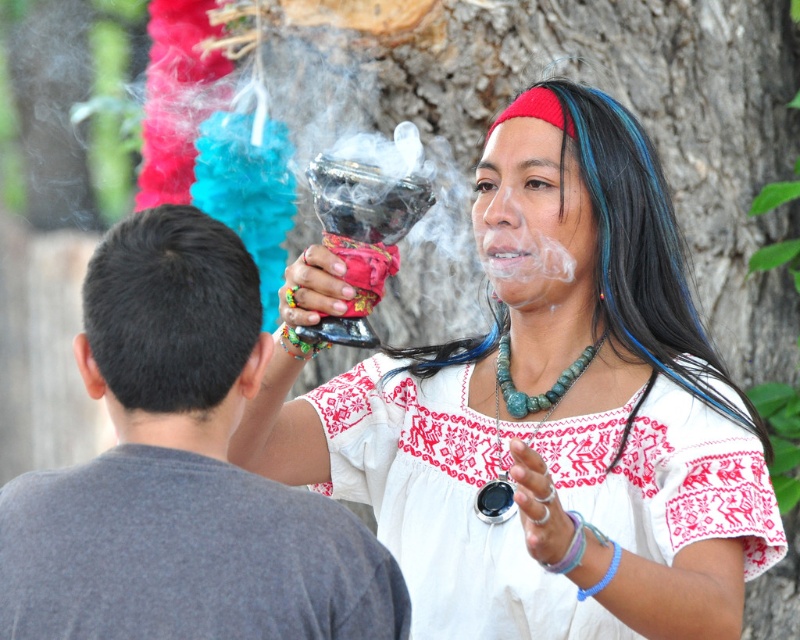
Consider the image. You are an event planner organizing a cultural exhibition and need to display two traditional garments. The gray cotton shirt at upper left and the white embroidered dress at center must be placed side by side. Which garment has a smaller width and should be positioned to the left to maintain visual balance?

The gray cotton shirt at upper left has a smaller width than the white embroidered dress at center, so it should be positioned to the left to maintain visual balance.

You are an anthropologist observing a cultural event. You notice the white embroidered dress at center and the turquoise stone necklace at center. Which object is bigger in size?

The white embroidered dress at center is larger in size compared to the turquoise stone necklace at center.